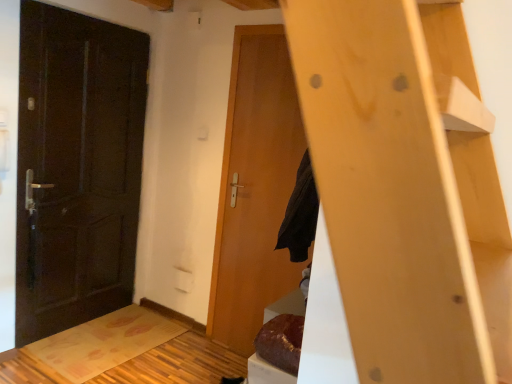
Question: Is matte dark brown door at left, which is the 1th door in left-to-right order, to the left or to the right of wooden door at center, which appears as the 2th door when viewed from the left, in the image?

Choices:
 (A) left
 (B) right

Answer: (A)

Question: From a real-world perspective, relative to wooden door at center, which is counted as the 1th door, starting from the right, is matte dark brown door at left, which is the 1th door in left-to-right order, vertically above or below?

Choices:
 (A) above
 (B) below

Answer: (A)

Question: From the image's perspective, is matte dark brown door at left, acting as the 2th door starting from the right, located above or below wooden door at center, which is counted as the 1th door, starting from the right?

Choices:
 (A) below
 (B) above

Answer: (B)

Question: Do you think wooden door at center, which is counted as the 1th door, starting from the right, is within matte dark brown door at left, which is the 1th door in left-to-right order, or outside of it?

Choices:
 (A) inside
 (B) outside

Answer: (B)

Question: Is wooden door at center, which appears as the 2th door when viewed from the left, bigger or smaller than matte dark brown door at left, acting as the 2th door starting from the right?

Choices:
 (A) big
 (B) small

Answer: (B)

Question: Does point (270, 168) appear closer or farther from the camera than point (57, 18)?

Choices:
 (A) closer
 (B) farther

Answer: (B)

Question: Is wooden door at center, which is counted as the 1th door, starting from the right, taller or shorter than matte dark brown door at left, which is the 1th door in left-to-right order?

Choices:
 (A) short
 (B) tall

Answer: (B)